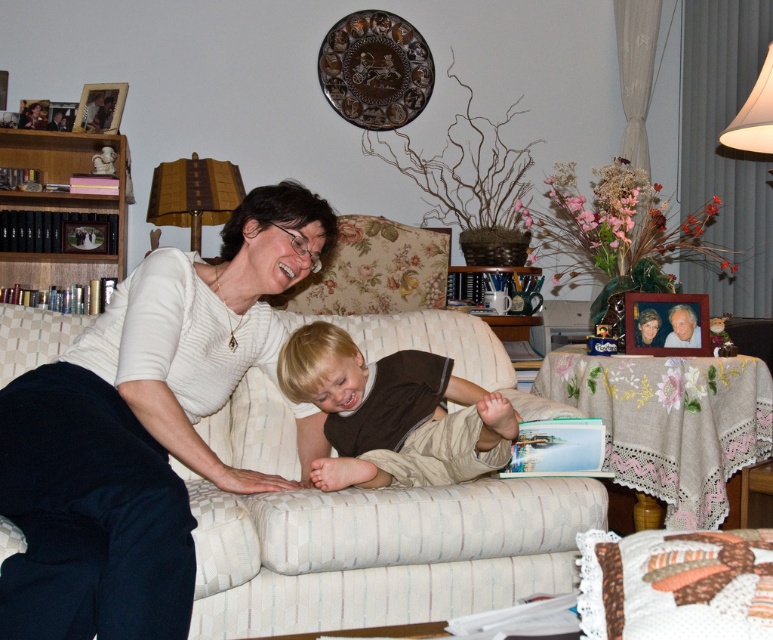
Does white matte sweater at center appear on the right side of blonde hair boy at center?

No, white matte sweater at center is not to the right of blonde hair boy at center.

Which is behind, point (104, 332) or point (285, 387)?

Positioned behind is point (285, 387).

Identify the location of white matte sweater at center. The image size is (773, 640). (142, 428).

Is white striped couch at center smaller than wooden books at left?

No, white striped couch at center is not smaller than wooden books at left.

Who is more distant from viewer, (x=438, y=582) or (x=126, y=228)?

Positioned behind is point (x=126, y=228).

Where is `white striped couch at center`? white striped couch at center is located at coordinates click(x=380, y=552).

Which is above, white striped couch at center or blonde hair boy at center?

blonde hair boy at center is higher up.

The image size is (773, 640). Find the location of `white striped couch at center`. white striped couch at center is located at coordinates (380, 552).

Who is more forward, (274, 428) or (484, 435)?

Point (484, 435) is more forward.

The image size is (773, 640). I want to click on white striped couch at center, so click(380, 552).